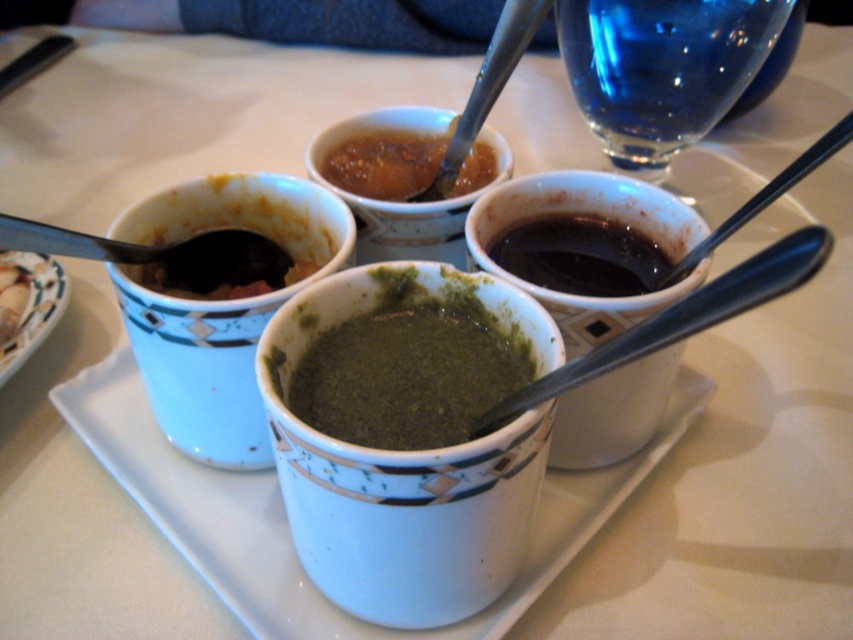
Question: Considering the relative positions of green matte soup at center and shiny brown sauce at center in the image provided, where is green matte soup at center located with respect to shiny brown sauce at center?

Choices:
 (A) left
 (B) right

Answer: (B)

Question: Which of these objects is positioned farthest from the dark glossy sauce at upper right?

Choices:
 (A) matte ceramic bowl at lower left
 (B) transparent glass at upper right
 (C) green matte soup at center
 (D) metallic spoon at upper left

Answer: (A)

Question: Which point appears farthest from the camera in this image?

Choices:
 (A) (637, 38)
 (B) (434, 196)
 (C) (24, 308)

Answer: (A)

Question: Which is farther from the dark glossy sauce at upper right?

Choices:
 (A) metallic spoon at upper left
 (B) shiny brown sauce at center
 (C) porcelain plate at lower left

Answer: (C)

Question: In this image, where is dark glossy sauce at upper right located relative to porcelain plate at lower left?

Choices:
 (A) above
 (B) below

Answer: (A)

Question: Can you confirm if porcelain plate at lower left is smaller than matte ceramic bowl at lower left?

Choices:
 (A) no
 (B) yes

Answer: (A)